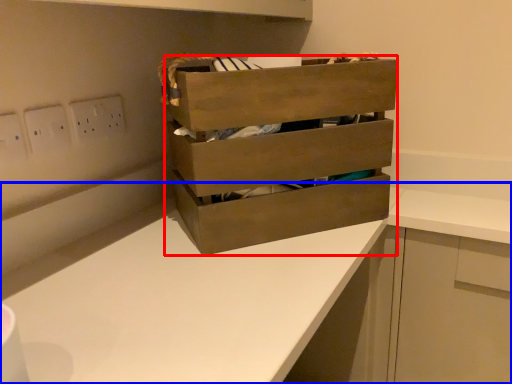
Question: Which of the following is the farthest to the observer, chest of drawers (highlighted by a red box) or counter (highlighted by a blue box)?

Choices:
 (A) chest of drawers
 (B) counter

Answer: (A)